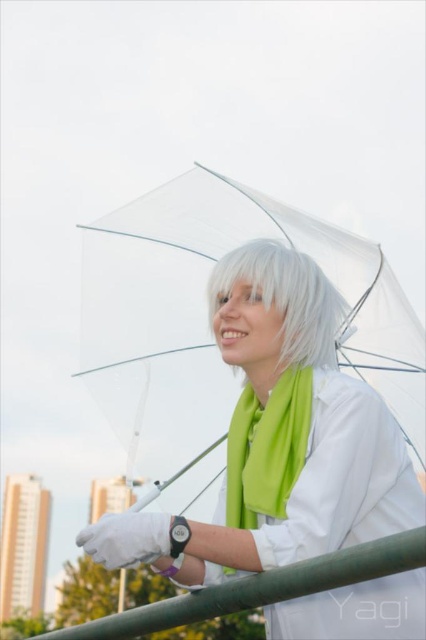
I want to click on green matte scarf at center, so click(x=267, y=449).

Consider the image. Can you confirm if green matte scarf at center is shorter than white matte hair at center?

No.

Does point (241, 456) lie behind point (298, 252)?

Yes.

Where is `green matte scarf at center`? This screenshot has height=640, width=426. green matte scarf at center is located at coordinates (267, 449).

Does translucent plastic umbrella at upper center appear on the right side of green matte scarf at center?

No, translucent plastic umbrella at upper center is not to the right of green matte scarf at center.

Measure the distance between translucent plastic umbrella at upper center and camera.

80.79 feet

At what (x,y) coordinates should I click in order to perform the action: click on translucent plastic umbrella at upper center. Please return your answer as a coordinate pair (x, y). Looking at the image, I should click on (279, 438).

Is translucent plastic umbrella at upper center positioned in front of white matte hair at center?

Yes, translucent plastic umbrella at upper center is closer to the viewer.

Is translucent plastic umbrella at upper center taller than white matte hair at center?

Yes.

What do you see at coordinates (279, 438) in the screenshot?
I see `translucent plastic umbrella at upper center` at bounding box center [279, 438].

What are the coordinates of `translucent plastic umbrella at upper center` in the screenshot? It's located at (279, 438).